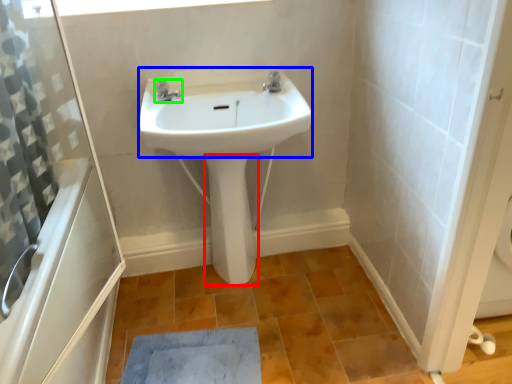
Question: Estimate the real-world distances between objects in this image. Which object is closer to bidet (highlighted by a red box), sink (highlighted by a blue box) or tap (highlighted by a green box)?

Choices:
 (A) sink
 (B) tap

Answer: (A)